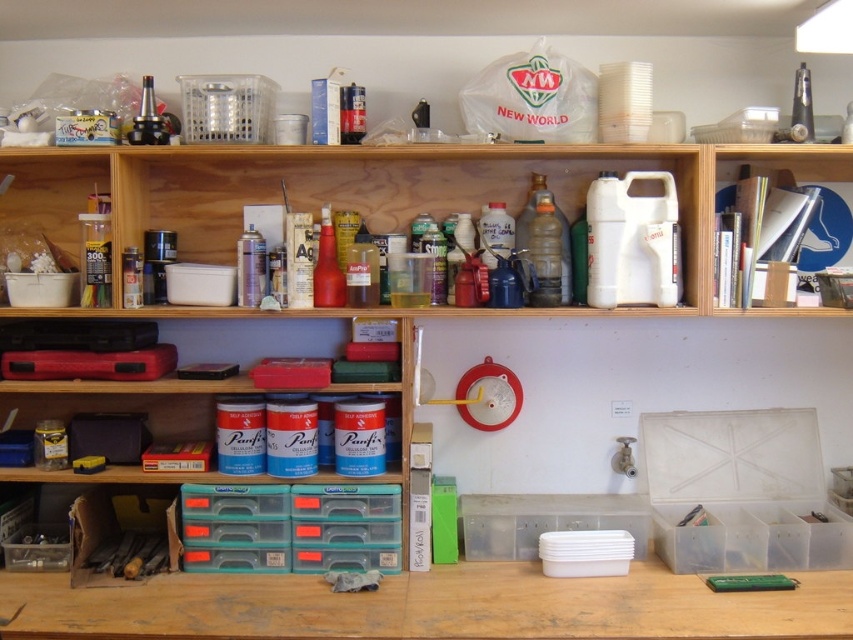
Locate an element on the screen. This screenshot has width=853, height=640. wooden bookshelf at upper right is located at coordinates (779, 163).

Between wooden bookshelf at upper right and matte red spray can at center, which one has less height?

With less height is wooden bookshelf at upper right.

Is point (834, 150) positioned before point (320, 227)?

Yes, point (834, 150) is closer to viewer.

What are the coordinates of `wooden bookshelf at upper right` in the screenshot? It's located at (779, 163).

Between matte plastic container at left and matte red spray can at center, which one is positioned lower?

matte red spray can at center

Is point (13, 182) farther from viewer compared to point (323, 248)?

Yes, it is behind point (323, 248).

Locate an element on the screen. This screenshot has width=853, height=640. matte plastic container at left is located at coordinates (53, 188).

Which is below, matte plastic container at left or wooden bookshelf at upper right?

matte plastic container at left is below.

Where is `matte plastic container at left`? The image size is (853, 640). matte plastic container at left is located at coordinates (53, 188).